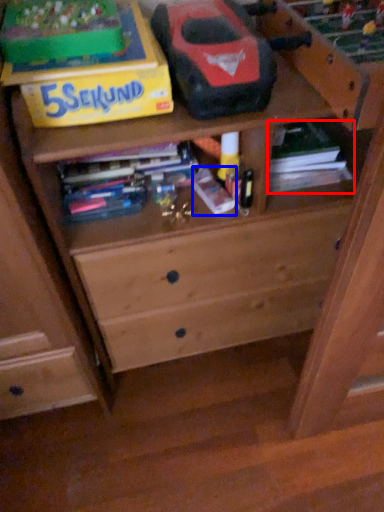
Question: Which of the following is the farthest to the observer, book (highlighted by a red box) or book (highlighted by a blue box)?

Choices:
 (A) book
 (B) book

Answer: (A)